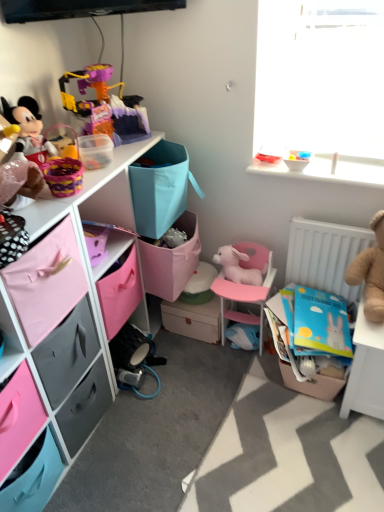
Question: In terms of height, does pink plastic chair at center look taller or shorter compared to plastic toy at upper left, the second toy positioned from the left?

Choices:
 (A) tall
 (B) short

Answer: (A)

Question: Is pink plastic chair at center in front of or behind plastic toy at upper left, the second toy positioned from the left, in the image?

Choices:
 (A) behind
 (B) front

Answer: (A)

Question: Estimate the real-world distances between objects in this image. Which object is closer to the white plastic spoon at upper right, the 2th toy from the right?

Choices:
 (A) translucent plastic bowl at upper right, which ranks as the 5th toy in left-to-right order
 (B) plastic toy at upper left, the second toy positioned from the left
 (C) gray matte drawer at lower left, placed as the 2th drawer when sorted from front to back
 (D) pink plastic chair at center
 (E) matte black plush toy at left, which is counted as the seventh toy, starting from the right

Answer: (A)

Question: Which is nearer to the pink fabric drawer at lower left, positioned as the second drawer in back-to-front order?

Choices:
 (A) gray matte drawer at lower left, the 1th drawer in the back-to-front sequence
 (B) brown plush bear at right, which is the 1th toy in right-to-left order
 (C) white plastic spoon at upper right, the 2th toy from the right
 (D) translucent plastic bowl at upper right, which ranks as the 5th toy in left-to-right order
 (E) pink plush rabbit at center, which is the 3th toy in left-to-right order

Answer: (A)